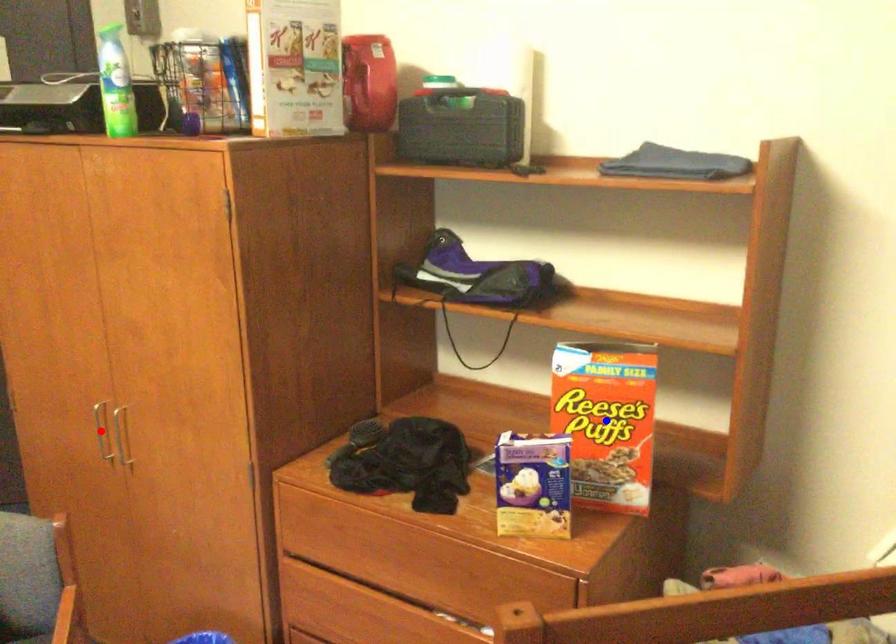
Question: Which of the two points in the image is closer to the camera?

Choices:
 (A) Blue point is closer.
 (B) Red point is closer.

Answer: (A)